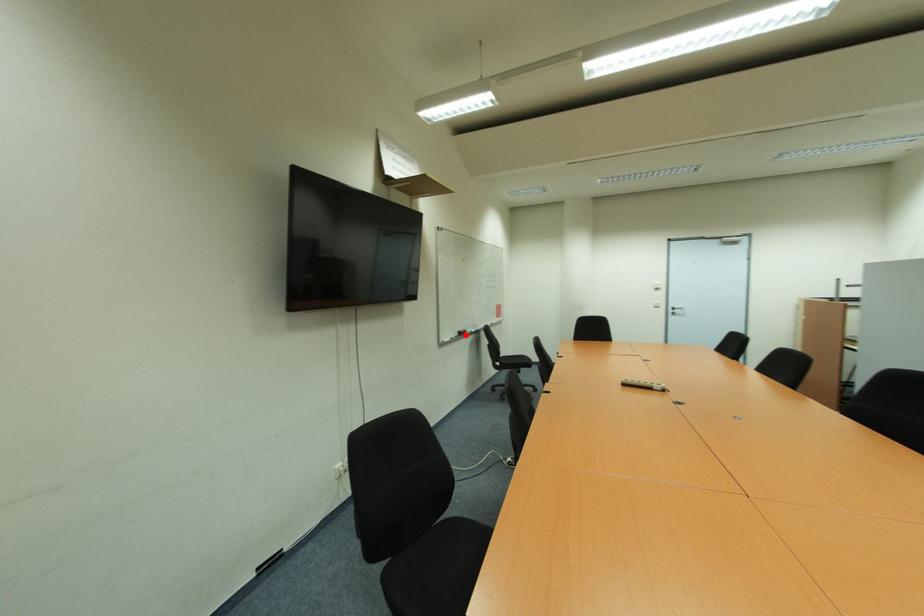
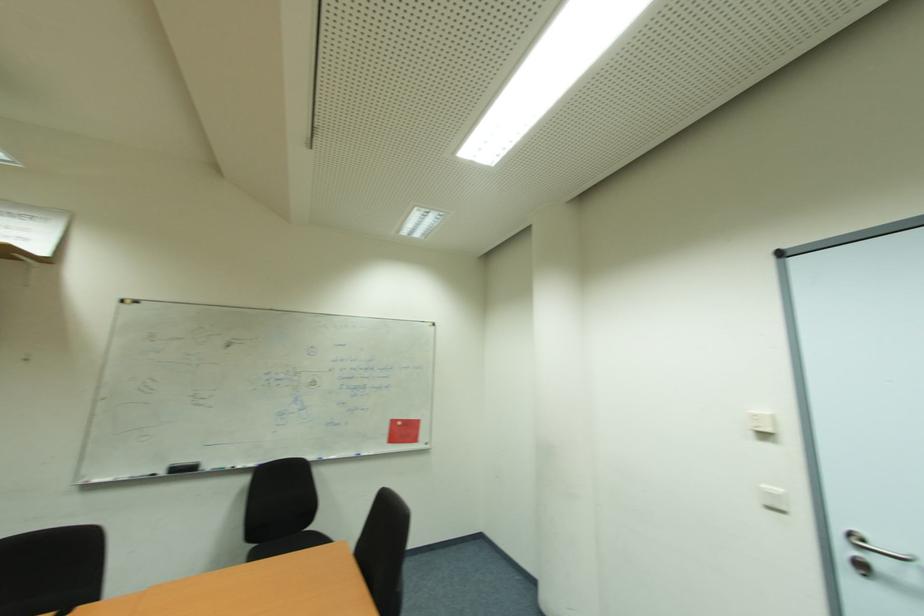
Where in the second image is the point corresponding to the highlighted location from the first image?

(189, 469)